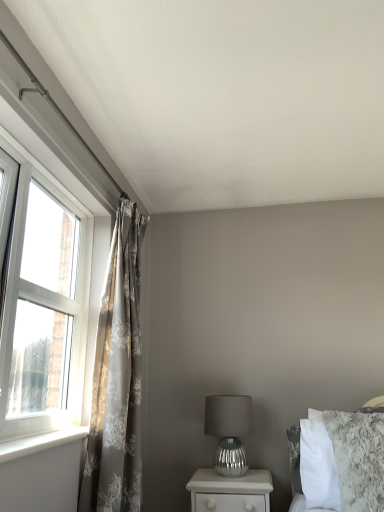
Question: From a real-world perspective, relative to white plastic window sill at left, is silver metallic nightstand at lower center vertically above or below?

Choices:
 (A) below
 (B) above

Answer: (A)

Question: Is silver metallic nightstand at lower center in front of or behind white plastic window sill at left in the image?

Choices:
 (A) front
 (B) behind

Answer: (B)

Question: Which object is positioned closest to the silver metallic nightstand at lower center?

Choices:
 (A) white fluffy bed at upper right
 (B) silky gray curtains at left
 (C) white plastic window sill at left
 (D) silver metallic table lamp at center
 (E) white plastic window at left

Answer: (D)

Question: Estimate the real-world distances between objects in this image. Which object is farther from the white plastic window sill at left?

Choices:
 (A) white plastic window at left
 (B) silky gray curtains at left
 (C) white fluffy bed at upper right
 (D) silver metallic table lamp at center
 (E) silver metallic nightstand at lower center

Answer: (C)